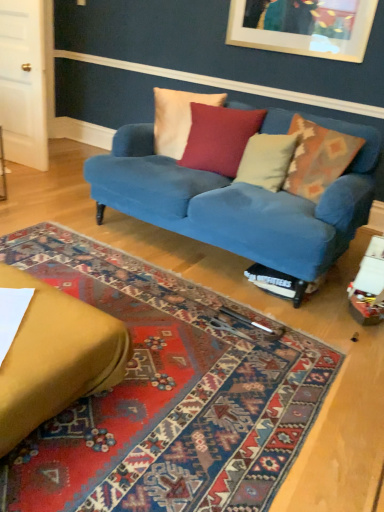
You are a GUI agent. You are given a task and a screenshot of the screen. Output one action in this format:
    pyautogui.click(x=<x>, y=<y>)
    Task: Click on the carpeted rug at center
    
    Given the screenshot: What is the action you would take?
    pyautogui.click(x=166, y=395)

The image size is (384, 512). What are the coordinates of `velvet blue couch at center, arranged as the 2th studio couch when viewed from the front` in the screenshot? It's located at (238, 202).

Locate an element on the screen. The image size is (384, 512). velvet cushion at center, the second pillow from the left is located at coordinates (219, 138).

What is the approximate height of velvet cushion at center, the second pillow from the left?

The height of velvet cushion at center, the second pillow from the left, is 19.15 inches.

Image resolution: width=384 pixels, height=512 pixels. In order to click on white cotton pillow at center, the first pillow viewed from the left in this screenshot , I will do `click(177, 118)`.

Would you say white soft pillow at center, which is counted as the third pillow, starting from the left, is inside or outside carpeted rug at center?

white soft pillow at center, which is counted as the third pillow, starting from the left, cannot be found inside carpeted rug at center.

Is white soft pillow at center, the second pillow from the right, far from carpeted rug at center?

Yes, white soft pillow at center, the second pillow from the right, and carpeted rug at center are quite far apart.

I want to click on mat in front of the white soft pillow at center, the second pillow from the right, so click(166, 395).

How different are the orientations of white soft pillow at center, the second pillow from the right, and carpeted rug at center in degrees?

The angular difference between white soft pillow at center, the second pillow from the right, and carpeted rug at center is 78.7 degrees.

Which object is thinner, velvet blue couch at center, placed as the 1th studio couch when sorted from back to front, or white cotton pillow at center, which is the fourth pillow from right to left?

white cotton pillow at center, which is the fourth pillow from right to left, is thinner.

Locate an element on the screen. pillow that is the 4th object located above the velvet blue couch at center, arranged as the 2th studio couch when viewed from the front (from the image's perspective) is located at coordinates (177, 118).

From the image's perspective, is velvet blue couch at center, placed as the 1th studio couch when sorted from back to front, located beneath white cotton pillow at center, which is the fourth pillow from right to left?

Yes, from the image's perspective, velvet blue couch at center, placed as the 1th studio couch when sorted from back to front, is beneath white cotton pillow at center, which is the fourth pillow from right to left.

From a real-world perspective, is velvet blue couch at center, placed as the 1th studio couch when sorted from back to front, physically above white cotton pillow at center, which is the fourth pillow from right to left?

No, from a real-world perspective, velvet blue couch at center, placed as the 1th studio couch when sorted from back to front, is not above white cotton pillow at center, which is the fourth pillow from right to left.

Considering the sizes of objects white soft pillow at center, the second pillow from the right, and velvet cushion at center, the third pillow when ordered from right to left, in the image provided, who is smaller, white soft pillow at center, the second pillow from the right, or velvet cushion at center, the third pillow when ordered from right to left,?

white soft pillow at center, the second pillow from the right, is smaller.

Is white soft pillow at center, the second pillow from the right, next to velvet cushion at center, the second pillow from the left, and touching it?

There is a gap between white soft pillow at center, the second pillow from the right, and velvet cushion at center, the second pillow from the left.

Consider the image. Considering the relative positions of white soft pillow at center, which is counted as the third pillow, starting from the left, and velvet cushion at center, the third pillow when ordered from right to left, in the image provided, is white soft pillow at center, which is counted as the third pillow, starting from the left, to the right of velvet cushion at center, the third pillow when ordered from right to left, from the viewer's perspective?

Yes, white soft pillow at center, which is counted as the third pillow, starting from the left, is to the right of velvet cushion at center, the third pillow when ordered from right to left.

How many degrees apart are the facing directions of white soft pillow at center, the second pillow from the right, and velvet cushion at center, the second pillow from the left?

The angle between the facing direction of white soft pillow at center, the second pillow from the right, and the facing direction of velvet cushion at center, the second pillow from the left, is 29.5 degrees.

Is carpeted rug at center at the back of velvet yellow studio couch at lower left, which is counted as the first studio couch, starting from the front?

That's not correct — velvet yellow studio couch at lower left, which is counted as the first studio couch, starting from the front, is not looking away from carpeted rug at center.

Which object is wider, velvet yellow studio couch at lower left, which is counted as the first studio couch, starting from the front, or carpeted rug at center?

With larger width is carpeted rug at center.

From the picture: Can you confirm if velvet yellow studio couch at lower left, which ranks as the second studio couch in back-to-front order, is positioned to the left of carpeted rug at center?

Yes, velvet yellow studio couch at lower left, which ranks as the second studio couch in back-to-front order, is to the left of carpeted rug at center.

Considering the sizes of objects velvet yellow studio couch at lower left, which ranks as the second studio couch in back-to-front order, and carpeted rug at center in the image provided, who is shorter, velvet yellow studio couch at lower left, which ranks as the second studio couch in back-to-front order, or carpeted rug at center?

With less height is carpeted rug at center.

Considering the sizes of objects white soft pillow at center, which is counted as the third pillow, starting from the left, and white cotton pillow at center, which is the fourth pillow from right to left, in the image provided, who is taller, white soft pillow at center, which is counted as the third pillow, starting from the left, or white cotton pillow at center, which is the fourth pillow from right to left,?

white cotton pillow at center, which is the fourth pillow from right to left.

Measure the distance from white soft pillow at center, the second pillow from the right, to white cotton pillow at center, which is the fourth pillow from right to left.

white soft pillow at center, the second pillow from the right, and white cotton pillow at center, which is the fourth pillow from right to left, are 20.71 inches apart from each other.

Which of these two, white soft pillow at center, the second pillow from the right, or white cotton pillow at center, which is the fourth pillow from right to left, is thinner?

white cotton pillow at center, which is the fourth pillow from right to left, is thinner.

Locate an element on the screen. the 3rd pillow positioned above the white soft pillow at center, the second pillow from the right (from a real-world perspective) is located at coordinates (177, 118).

Are velvet blue couch at center, arranged as the 2th studio couch when viewed from the front, and velvet cushion at center, the second pillow from the left, making contact?

velvet blue couch at center, arranged as the 2th studio couch when viewed from the front, and velvet cushion at center, the second pillow from the left, are not in contact.

Is velvet blue couch at center, placed as the 1th studio couch when sorted from back to front, bigger or smaller than velvet cushion at center, the second pillow from the left?

Considering their sizes, velvet blue couch at center, placed as the 1th studio couch when sorted from back to front, takes up more space than velvet cushion at center, the second pillow from the left.

Based on the photo, can you tell me how much velvet blue couch at center, arranged as the 2th studio couch when viewed from the front, and velvet cushion at center, the second pillow from the left, differ in facing direction?

The angular difference between velvet blue couch at center, arranged as the 2th studio couch when viewed from the front, and velvet cushion at center, the second pillow from the left, is 17.5 degrees.

Find the location of `the 2nd studio couch in front of the textured wool pillow at center, the 4th pillow positioned from the left, starting your count from the anchor`. the 2nd studio couch in front of the textured wool pillow at center, the 4th pillow positioned from the left, starting your count from the anchor is located at coordinates (55, 357).

Can you confirm if textured wool pillow at center, which is the first pillow from right to left, is wider than velvet yellow studio couch at lower left, which ranks as the second studio couch in back-to-front order?

Incorrect, the width of textured wool pillow at center, which is the first pillow from right to left, does not surpass that of velvet yellow studio couch at lower left, which ranks as the second studio couch in back-to-front order.

Does textured wool pillow at center, the 4th pillow positioned from the left, have a larger size compared to velvet yellow studio couch at lower left, which ranks as the second studio couch in back-to-front order?

No, textured wool pillow at center, the 4th pillow positioned from the left, is not bigger than velvet yellow studio couch at lower left, which ranks as the second studio couch in back-to-front order.

How many degrees apart are the facing directions of textured wool pillow at center, the 4th pillow positioned from the left, and velvet yellow studio couch at lower left, which is counted as the first studio couch, starting from the front?

The angular difference between textured wool pillow at center, the 4th pillow positioned from the left, and velvet yellow studio couch at lower left, which is counted as the first studio couch, starting from the front, is 71.8 degrees.

You are a GUI agent. You are given a task and a screenshot of the screen. Output one action in this format:
    pyautogui.click(x=<x>, y=<y>)
    Task: Click on the mat in front of the white soft pillow at center, the second pillow from the right
    The width and height of the screenshot is (384, 512).
    Given the screenshot: What is the action you would take?
    pyautogui.click(x=166, y=395)

Image resolution: width=384 pixels, height=512 pixels. Find the location of `the 1st studio couch below the white cotton pillow at center, the first pillow viewed from the left (from the image's perspective)`. the 1st studio couch below the white cotton pillow at center, the first pillow viewed from the left (from the image's perspective) is located at coordinates (238, 202).

When comparing their distances from white cotton pillow at center, the first pillow viewed from the left, does textured wool pillow at center, which is the first pillow from right to left, or carpeted rug at center seem closer?

textured wool pillow at center, which is the first pillow from right to left.

Considering their positions, is carpeted rug at center positioned further to velvet cushion at center, the third pillow when ordered from right to left, than velvet yellow studio couch at lower left, which is counted as the first studio couch, starting from the front?

Among the two, velvet yellow studio couch at lower left, which is counted as the first studio couch, starting from the front, is located further to velvet cushion at center, the third pillow when ordered from right to left.

Estimate the real-world distances between objects in this image. Which object is closer to velvet blue couch at center, arranged as the 2th studio couch when viewed from the front, white soft pillow at center, which is counted as the third pillow, starting from the left, or carpeted rug at center?

The object closer to velvet blue couch at center, arranged as the 2th studio couch when viewed from the front, is white soft pillow at center, which is counted as the third pillow, starting from the left.

Which object lies nearer to the anchor point velvet cushion at center, the third pillow when ordered from right to left, carpeted rug at center or white cotton pillow at center, the first pillow viewed from the left?

The object closer to velvet cushion at center, the third pillow when ordered from right to left, is white cotton pillow at center, the first pillow viewed from the left.

Looking at the image, which one is located closer to velvet blue couch at center, placed as the 1th studio couch when sorted from back to front, velvet yellow studio couch at lower left, which is counted as the first studio couch, starting from the front, or textured wool pillow at center, which is the first pillow from right to left?

textured wool pillow at center, which is the first pillow from right to left, lies closer to velvet blue couch at center, placed as the 1th studio couch when sorted from back to front, than the other object.

Estimate the real-world distances between objects in this image. Which object is closer to white cotton pillow at center, which is the fourth pillow from right to left, velvet yellow studio couch at lower left, which ranks as the second studio couch in back-to-front order, or textured wool pillow at center, the 4th pillow positioned from the left?

Based on the image, textured wool pillow at center, the 4th pillow positioned from the left, appears to be nearer to white cotton pillow at center, which is the fourth pillow from right to left.

When comparing their distances from velvet cushion at center, the second pillow from the left, does velvet blue couch at center, placed as the 1th studio couch when sorted from back to front, or velvet yellow studio couch at lower left, which ranks as the second studio couch in back-to-front order, seem closer?

velvet blue couch at center, placed as the 1th studio couch when sorted from back to front.

When comparing their distances from carpeted rug at center, does velvet yellow studio couch at lower left, which ranks as the second studio couch in back-to-front order, or textured wool pillow at center, the 4th pillow positioned from the left, seem closer?

The object closer to carpeted rug at center is velvet yellow studio couch at lower left, which ranks as the second studio couch in back-to-front order.

Identify the location of pillow situated between velvet cushion at center, the second pillow from the left, and textured wool pillow at center, which is the first pillow from right to left, from left to right. The image size is (384, 512). (266, 160).

The width and height of the screenshot is (384, 512). Find the location of `mat between velvet yellow studio couch at lower left, which ranks as the second studio couch in back-to-front order, and textured wool pillow at center, the 4th pillow positioned from the left, in the horizontal direction`. mat between velvet yellow studio couch at lower left, which ranks as the second studio couch in back-to-front order, and textured wool pillow at center, the 4th pillow positioned from the left, in the horizontal direction is located at coordinates (166, 395).

This screenshot has width=384, height=512. In order to click on studio couch between velvet yellow studio couch at lower left, which is counted as the first studio couch, starting from the front, and white soft pillow at center, the second pillow from the right, along the z-axis in this screenshot , I will do `click(238, 202)`.

Where is `pillow positioned between velvet blue couch at center, placed as the 1th studio couch when sorted from back to front, and white soft pillow at center, which is counted as the third pillow, starting from the left, from near to far`? This screenshot has height=512, width=384. pillow positioned between velvet blue couch at center, placed as the 1th studio couch when sorted from back to front, and white soft pillow at center, which is counted as the third pillow, starting from the left, from near to far is located at coordinates (318, 158).